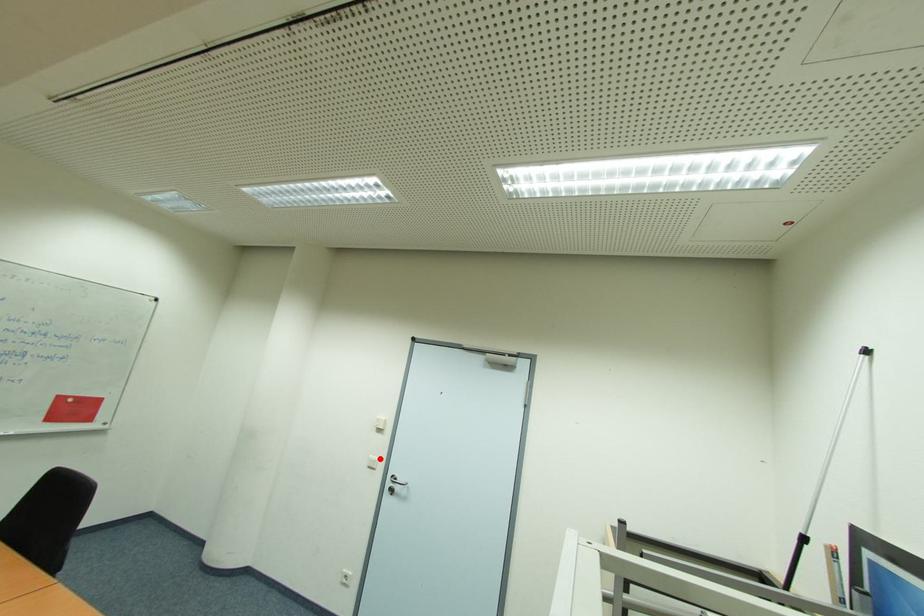
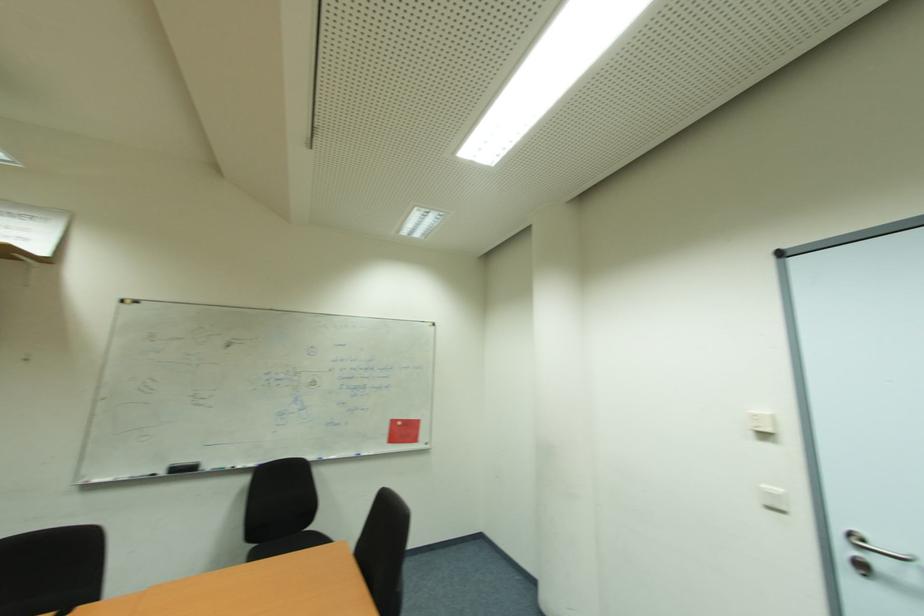
Question: A red point is marked in image1. In image2, is the corresponding 3D point closer to the camera or farther? Reply with the corresponding letter.

Choices:
 (A) The corresponding 3D point is closer.
 (B) The corresponding 3D point is farther.

Answer: (A)